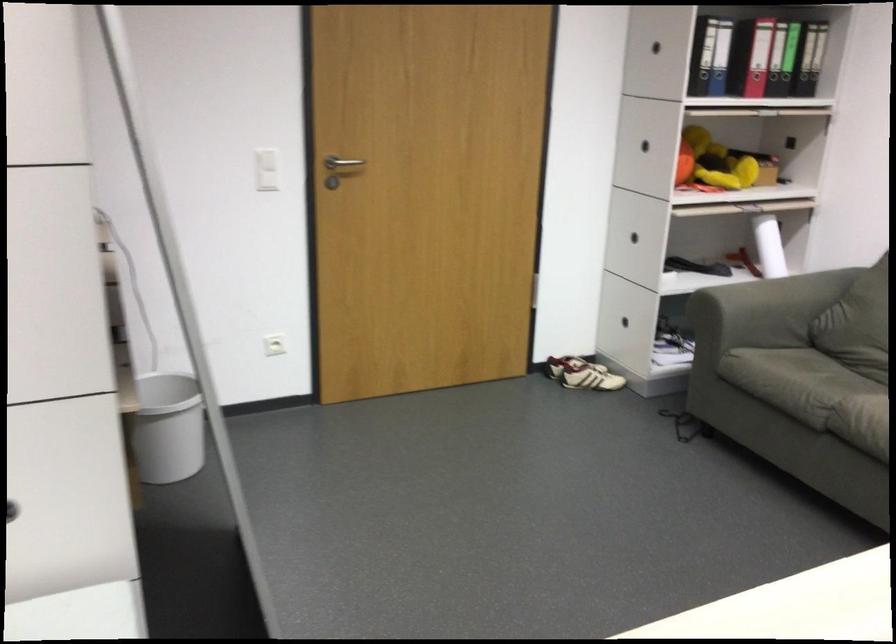
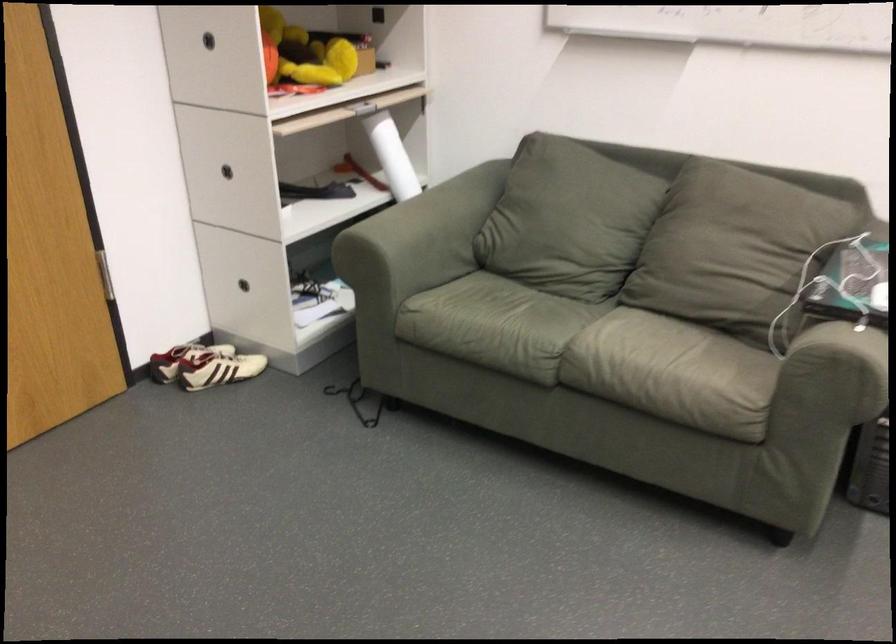
Where in the second image is the point corresponding to (x=716, y=240) from the first image?

(330, 161)